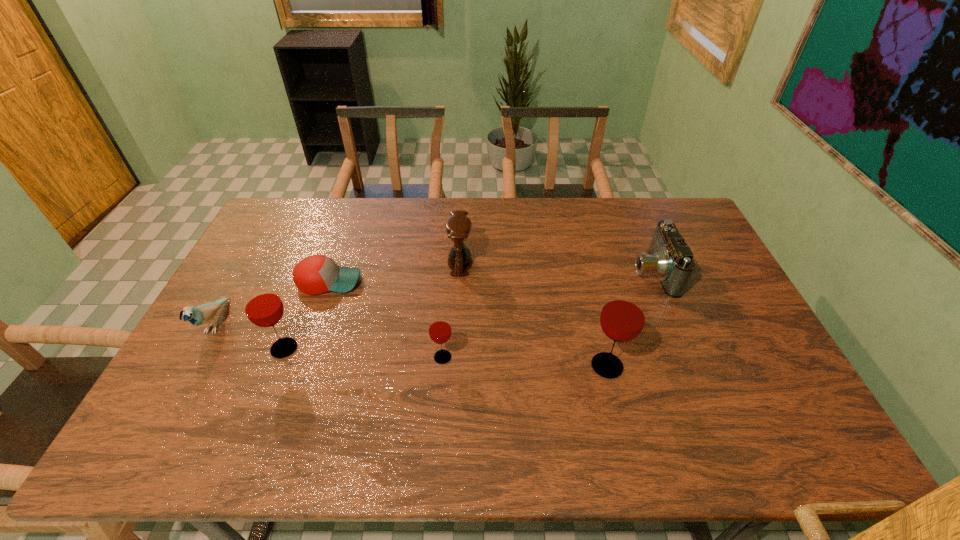
Find the location of a particular element. This screenshot has width=960, height=540. vacant region at the far edge of the desktop is located at coordinates (613, 203).

At what (x,y) coordinates should I click in order to perform the action: click on vacant space at the near edge of the desktop. Please return your answer as a coordinate pair (x, y). The image size is (960, 540). Looking at the image, I should click on (727, 411).

Locate an element on the screen. The height and width of the screenshot is (540, 960). vacant space at the left edge is located at coordinates (228, 372).

This screenshot has width=960, height=540. In the image, there is a desktop. Identify the location of free region at the right edge. (734, 299).

At what (x,y) coordinates should I click in order to perform the action: click on free space at the near left corner of the desktop. Please return your answer as a coordinate pair (x, y). The width and height of the screenshot is (960, 540). Looking at the image, I should click on (166, 411).

This screenshot has height=540, width=960. Identify the location of free spot between the second tallest object and the hourglass. (372, 306).

In order to click on free area in between the second object from right to left and the leftmost object in this screenshot , I will do `click(411, 345)`.

Identify the location of vacant space that's between the second glass from left to right and the baseball cap. (386, 319).

The height and width of the screenshot is (540, 960). What are the coordinates of `free spot between the baseball cap and the rightmost glass` in the screenshot? It's located at (468, 323).

At what (x,y) coordinates should I click in order to perform the action: click on unoccupied area between the leftmost object and the sixth shortest object. Please return your answer as a coordinate pair (x, y). This screenshot has height=540, width=960. Looking at the image, I should click on (250, 336).